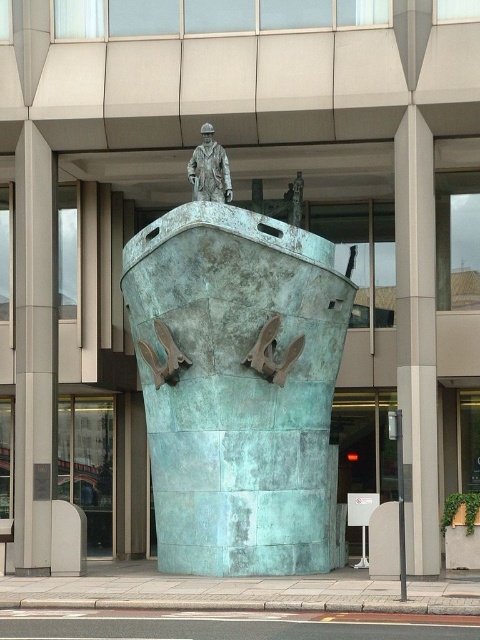
Question: Among these points, which one is farthest from the camera?

Choices:
 (A) (280, 273)
 (B) (414, 278)

Answer: (B)

Question: Which of these objects is positioned farthest from the green patina ship at center?

Choices:
 (A) matte gray pillar at left
 (B) bronze statue at center

Answer: (A)

Question: Is bronze statue at center positioned in front of green patina anchor at lower center?

Choices:
 (A) no
 (B) yes

Answer: (B)

Question: Is bronze statue at center above green patina anchor at lower center?

Choices:
 (A) no
 (B) yes

Answer: (B)

Question: Does green patina ship at center have a smaller size compared to matte gray pillar at left?

Choices:
 (A) no
 (B) yes

Answer: (B)

Question: Among these objects, which one is nearest to the camera?

Choices:
 (A) green patina anchor at center
 (B) bronze statue at center

Answer: (B)